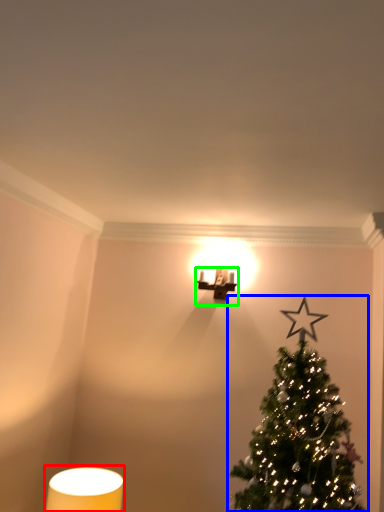
Question: Which object is positioned closest to table lamp (highlighted by a red box)? Select from christmas tree (highlighted by a blue box) and table lamp (highlighted by a green box).

Choices:
 (A) christmas tree
 (B) table lamp

Answer: (A)